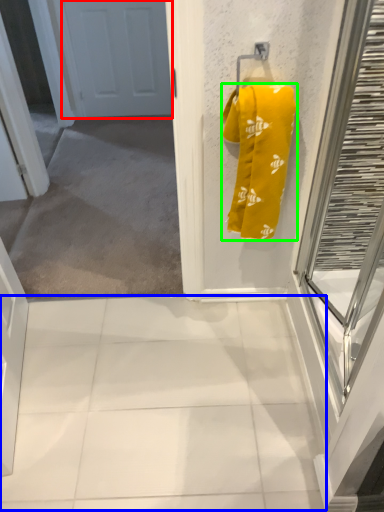
Question: Which object is the closest to the door (highlighted by a red box)? Choose among these: tile (highlighted by a blue box) or towel (highlighted by a green box).

Choices:
 (A) tile
 (B) towel

Answer: (B)